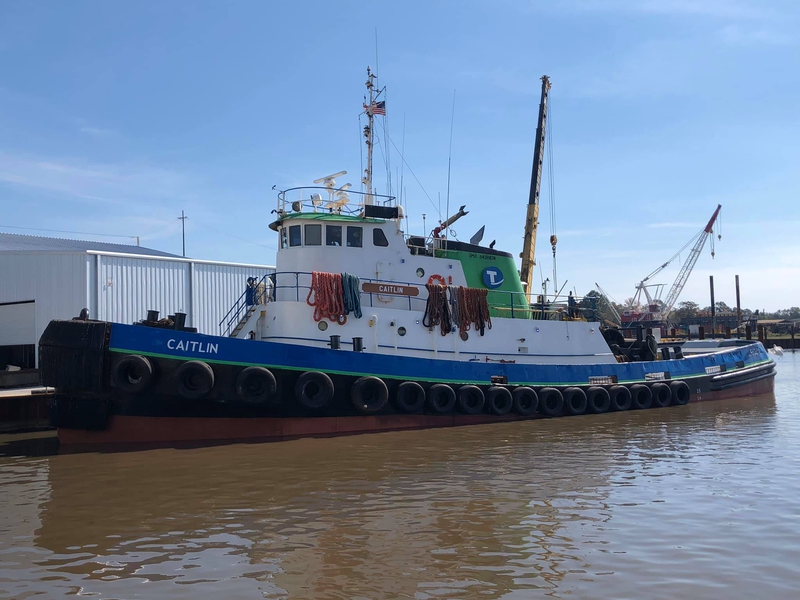
This screenshot has width=800, height=600. I want to click on window, so click(x=353, y=230).